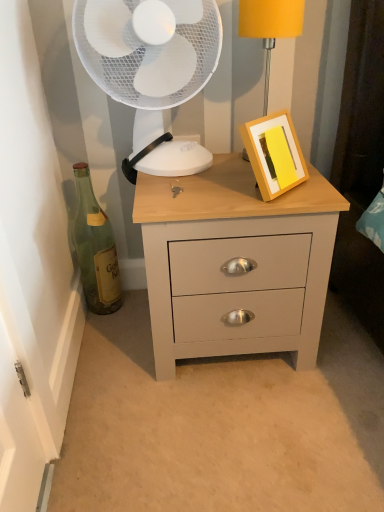
Locate an element on the screen. This screenshot has width=384, height=512. free spot in front of matte yellow lampshade at upper right is located at coordinates (250, 181).